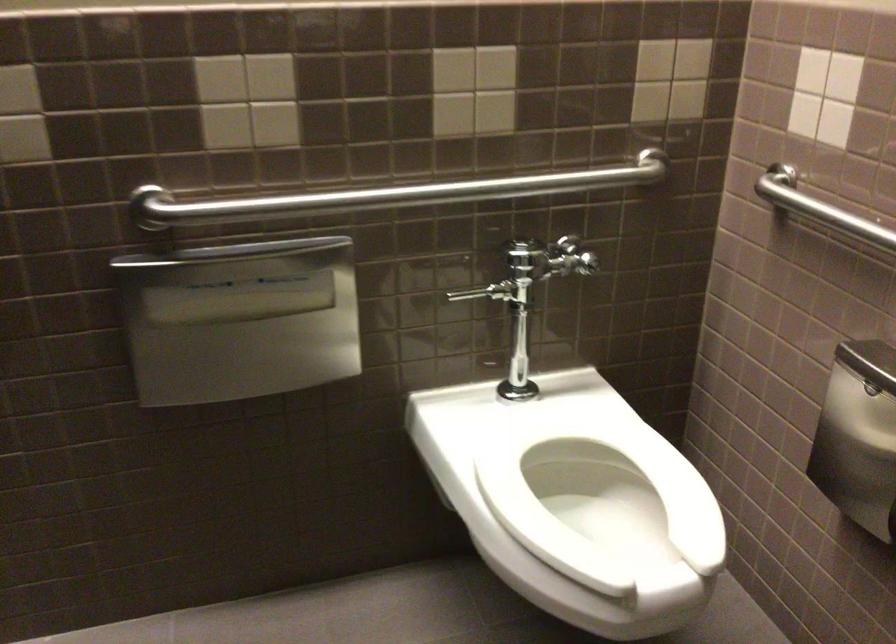
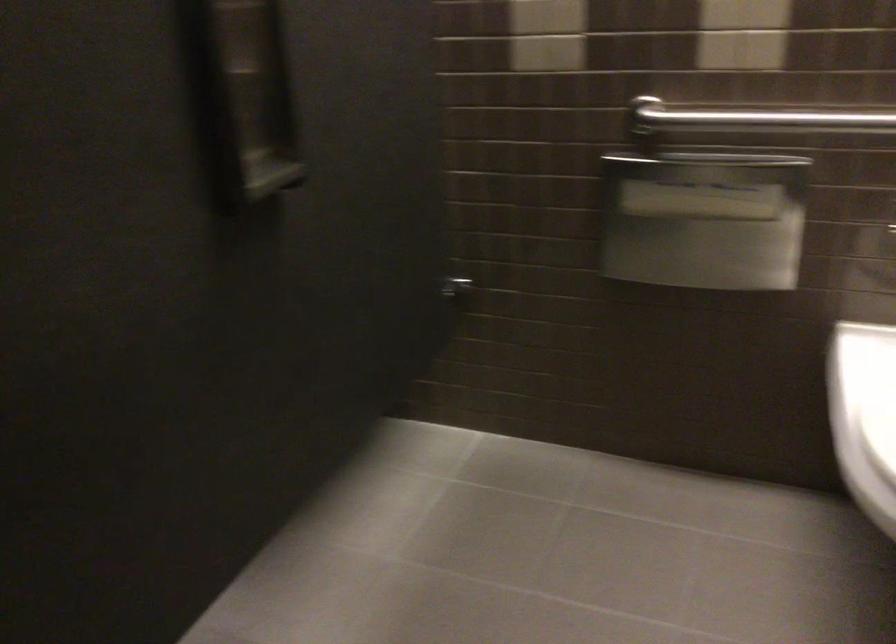
Find the pixel in the second image that matches point (289, 202) in the first image.

(751, 116)